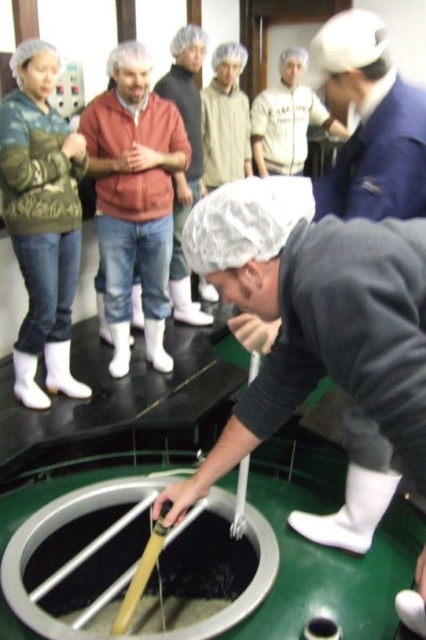
You are standing at the origin point in the image. Which object is located at the coordinates point (42, 220)?

The camouflage patterned jacket at upper left is located at point (42, 220).